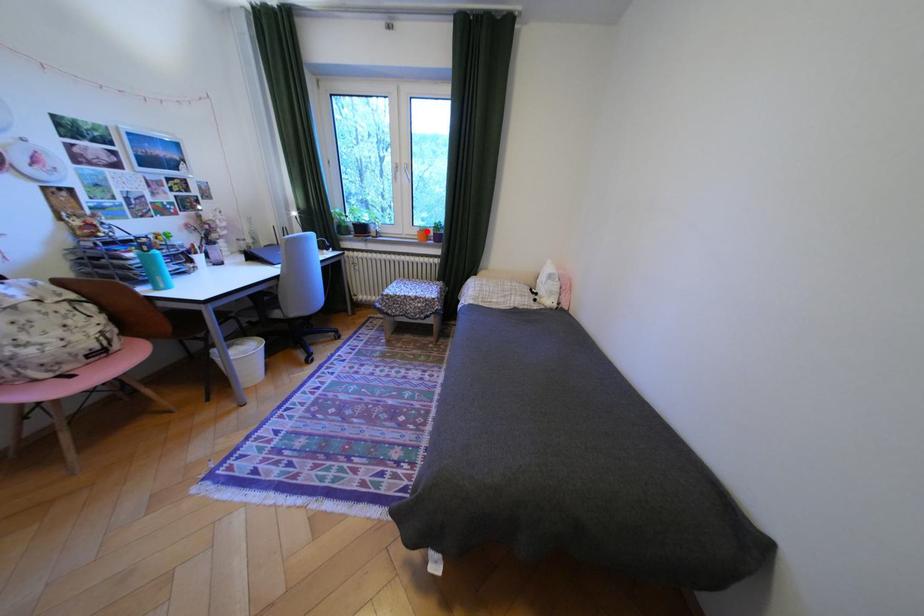
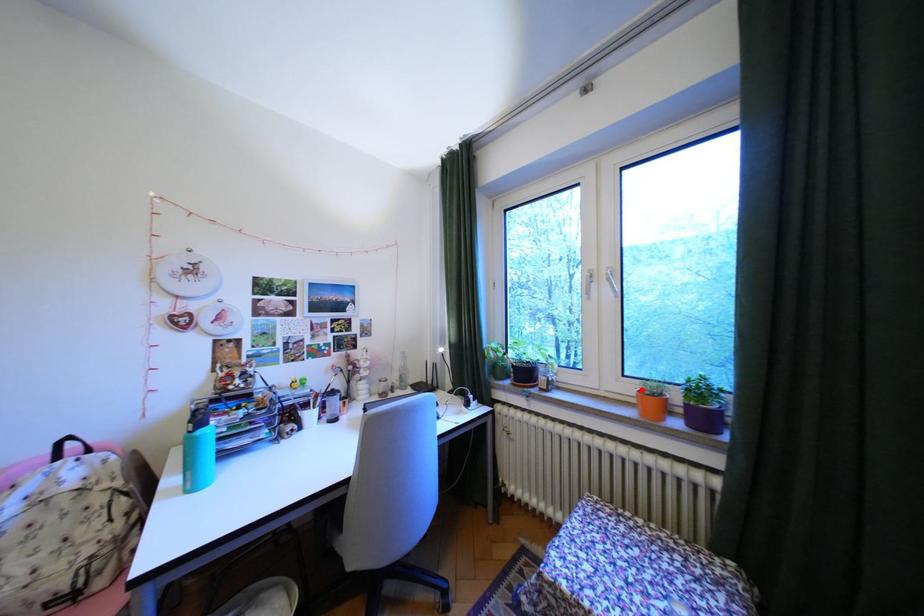
I am providing you with two images of the same scene from different viewpoints. A red point is marked on the first image and another point is marked on the second image. Do the highlighted points in image1 and image2 indicate the same real-world spot?

Yes